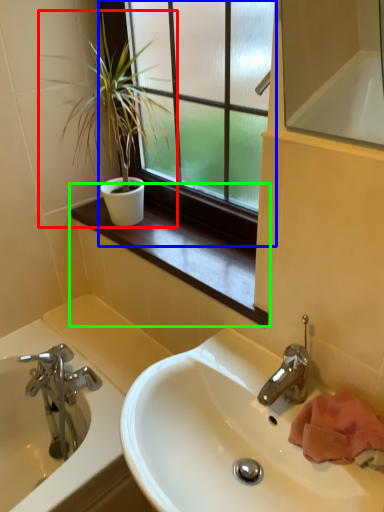
Question: Which object is positioned farthest from houseplant (highlighted by a red box)? Select from window (highlighted by a blue box) and window sill (highlighted by a green box).

Choices:
 (A) window
 (B) window sill

Answer: (B)